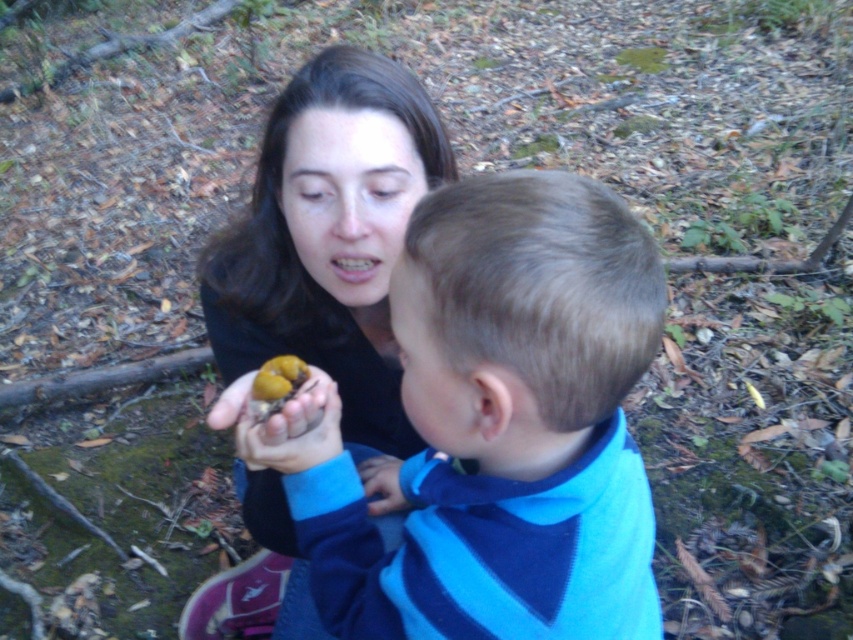
Who is more distant from viewer, [410,276] or [433,164]?

Point [433,164]

Can you confirm if blue striped sweater at center is positioned to the right of matte black sweater at center?

Indeed, blue striped sweater at center is positioned on the right side of matte black sweater at center.

You are a GUI agent. You are given a task and a screenshot of the screen. Output one action in this format:
    pyautogui.click(x=<x>, y=<y>)
    Task: Click on the blue striped sweater at center
    
    Given the screenshot: What is the action you would take?
    click(498, 428)

This screenshot has height=640, width=853. In order to click on blue striped sweater at center in this screenshot , I will do `click(498, 428)`.